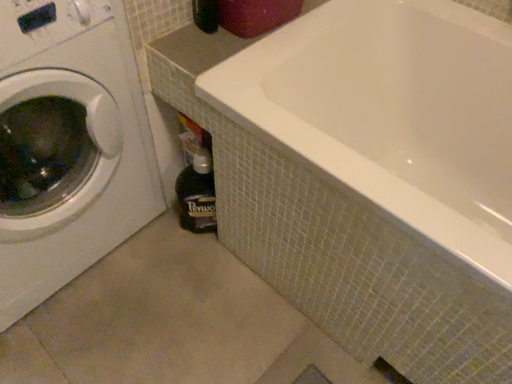
Question: Is point (10, 167) closer or farther from the camera than point (202, 220)?

Choices:
 (A) closer
 (B) farther

Answer: (A)

Question: In terms of width, does white glossy washing machine at left look wider or thinner when compared to dark brown glass bottle at lower center?

Choices:
 (A) thin
 (B) wide

Answer: (B)

Question: Which is nearer to the white glossy washing machine at left?

Choices:
 (A) white glossy bathtub at center
 (B) dark brown glass bottle at lower center

Answer: (B)

Question: Which object is the farthest from the dark brown glass bottle at lower center?

Choices:
 (A) white glossy bathtub at center
 (B) white glossy washing machine at left

Answer: (A)